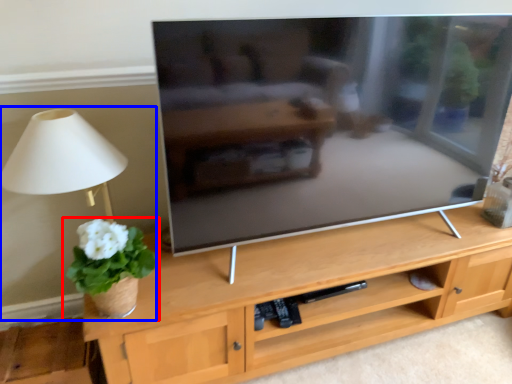
Question: Which point is further to the camera, houseplant (highlighted by a red box) or table lamp (highlighted by a blue box)?

Choices:
 (A) houseplant
 (B) table lamp

Answer: (B)